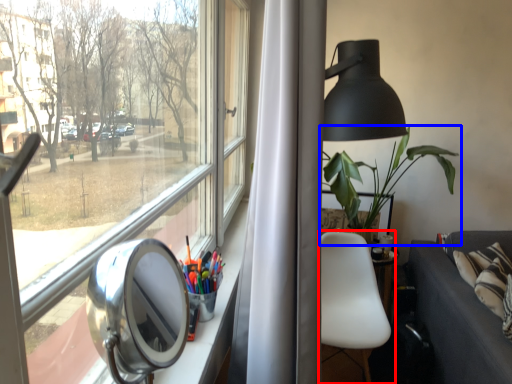
Question: Which point is further to the camera, chair (highlighted by a red box) or houseplant (highlighted by a blue box)?

Choices:
 (A) chair
 (B) houseplant

Answer: (B)